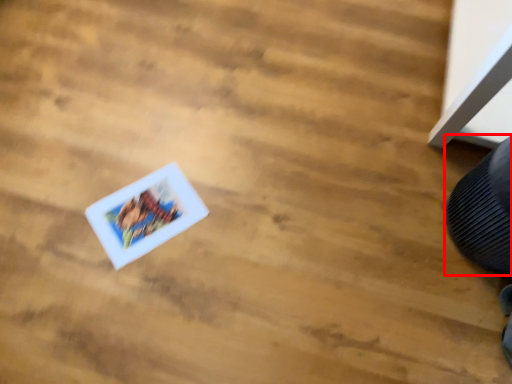
Question: Considering the relative positions of shoe (annotated by the red box) and comic book in the image provided, where is shoe (annotated by the red box) located with respect to the staircase?

Choices:
 (A) left
 (B) right

Answer: (B)